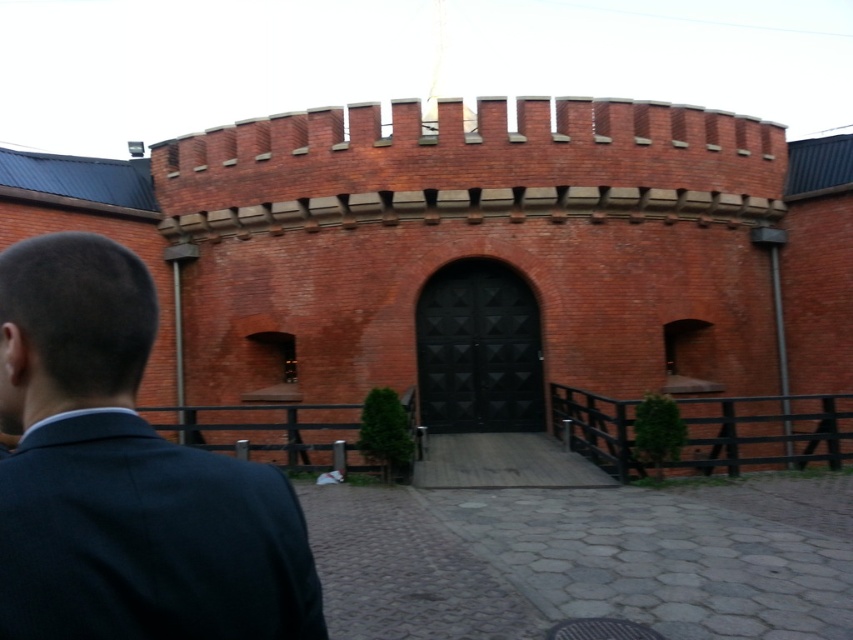
You are standing at the entrance of the red brick castle at center and want to greet the person in the dark blue suit at left. Which direction should you walk to reach them?

The red brick castle at center is positioned over the dark blue suit at left, meaning the person is to the left side of the castle. You should walk to the left side of the red brick castle at center to reach the person in the dark blue suit at left.

You are a visitor approaching the red brick castle at center. From your perspective, where is the dark blue suit at left located relative to the castle?

The dark blue suit at left is located behind the red brick castle at center from your perspective.